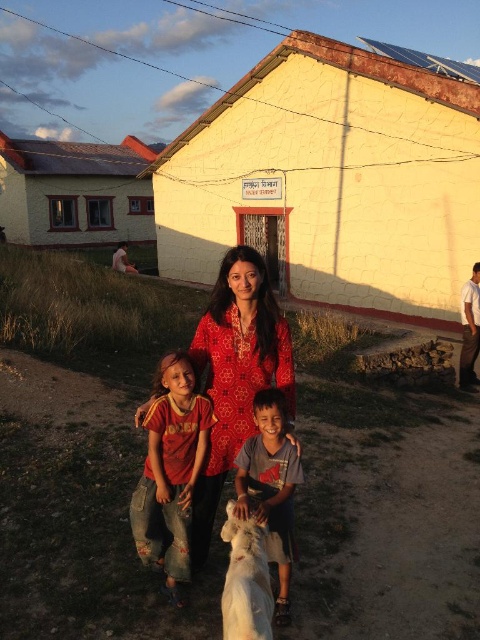
You are a photographer standing 2 meters away from the camera. You want to take a photo of the light blue cotton shirt at center. Can you reach the camera to adjust it without moving from your current position?

The light blue cotton shirt at center and camera are 2.79 meters apart. Since you are 2 meters away from the camera, the total distance between you and the shirt is 4.79 meters. You cannot reach the camera to adjust it without moving closer.

You are a photographer trying to capture a portrait of the woman and the dog. The light blue cotton shirt at center and the white fluffy dog at center are both in the frame. Based on their sizes, which one should you focus on first to ensure proper focus? Please explain your reasoning.

The light blue cotton shirt at center has a larger size compared to the white fluffy dog at center. Therefore, you should focus on the light blue cotton shirt at center first since larger objects require adjusting the focus to a closer range, ensuring both are in sharp focus.